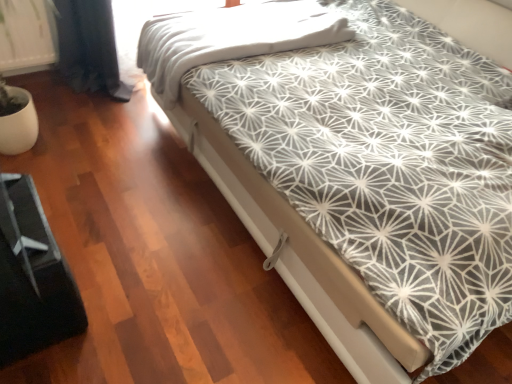
Find the location of a particular element. This screenshot has width=512, height=384. free space to the right of black plastic bed frame at lower left is located at coordinates [137, 309].